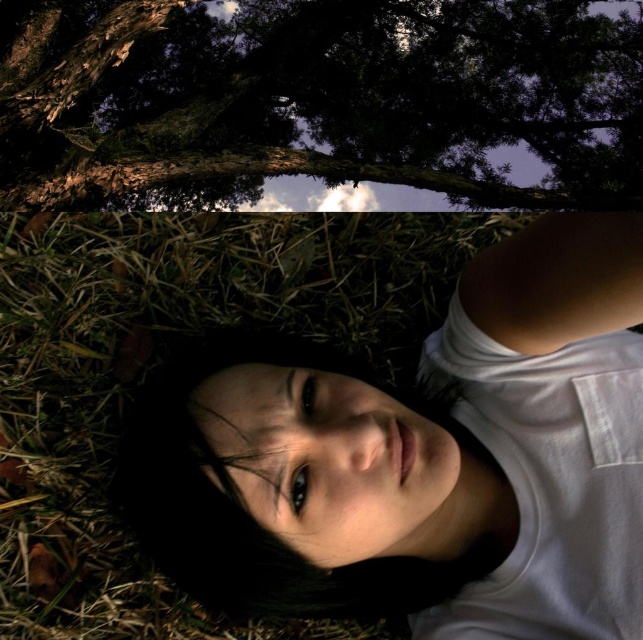
Question: Does white matte shirt at center appear under brown textured bark at upper center?

Choices:
 (A) yes
 (B) no

Answer: (A)

Question: Which point is farther from the camera taking this photo?

Choices:
 (A) (597, 100)
 (B) (613, 488)

Answer: (A)

Question: Where is white matte shirt at center located in relation to brown textured bark at upper center in the image?

Choices:
 (A) left
 (B) right

Answer: (B)

Question: Which of the following is the closest to the observer?

Choices:
 (A) (116, 35)
 (B) (323, 541)

Answer: (B)

Question: Is white matte shirt at center to the left of brown textured bark at upper center from the viewer's perspective?

Choices:
 (A) yes
 (B) no

Answer: (B)